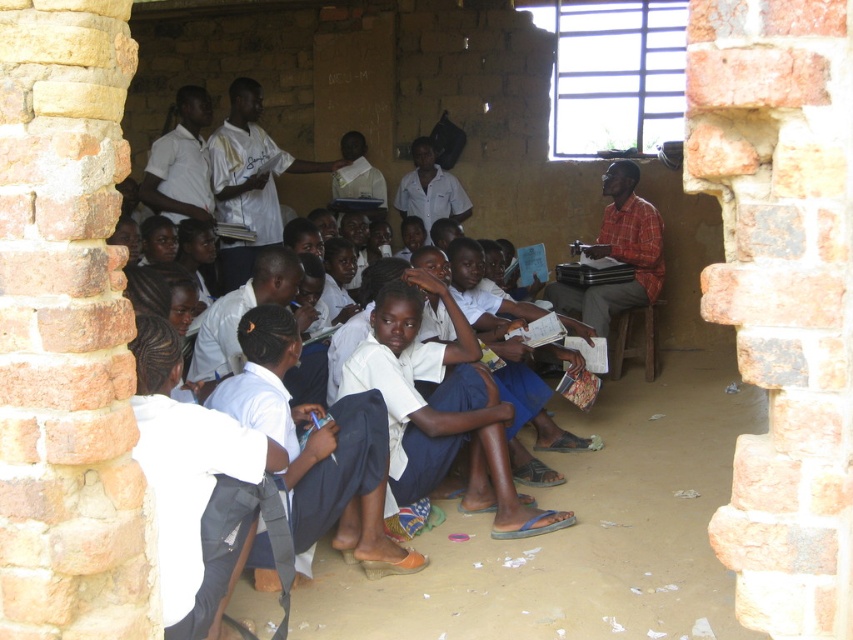
In the scene shown: Is brick at left further to camera compared to white cotton shirt at center?

No, it is not.

From the picture: Measure the distance between brick at left and camera.

brick at left is 2.08 meters from camera.

This screenshot has width=853, height=640. I want to click on brick at left, so click(67, 332).

Does point (231, 211) come farther from viewer compared to point (639, 208)?

No.

Does point (259, 208) come closer to viewer compared to point (653, 268)?

Yes, point (259, 208) is closer to viewer.

Where is `white shirt at center`? This screenshot has width=853, height=640. white shirt at center is located at coordinates [x=248, y=180].

Find the location of a particular element. white shirt at center is located at coordinates (248, 180).

Is white cotton shirt at center bigger than white shirt at center?

Actually, white cotton shirt at center might be smaller than white shirt at center.

Is white cotton shirt at center further to the viewer compared to white shirt at center?

That is False.

At what (x,y) coordinates should I click in order to perform the action: click on white cotton shirt at center. Please return your answer as a coordinate pair (x, y). The width and height of the screenshot is (853, 640). Looking at the image, I should click on (440, 408).